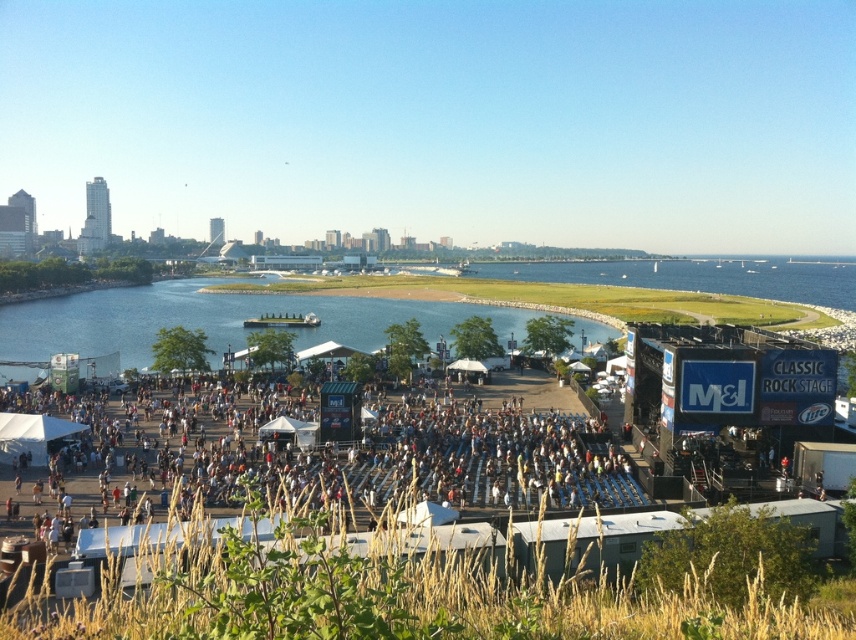
You are a photographer at the concert and want to capture a photo of the white fabric tent at center and the blue water at center. Which object is positioned to the right side of the other?

The white fabric tent at center is to the right of blue water at center.

You are a drone operator tasked with capturing aerial footage of the white fabric tent at center and blue water at center. Your drone has a maximum flight range of 70 meters. Can your drone safely capture footage of both locations without needing to recharge or return to base?

The white fabric tent at center and blue water at center are 71.15 meters apart from each other. Since the distance exceeds the drone s 70 meter range, the drone cannot safely capture footage of both locations without needing to recharge or return to base.

You are a photographer planning to capture the white fabric tent at center and the blue water at center in your shot. Based on the scene, which object is shorter in height?

The white fabric tent at center is shorter in height compared to the blue water at center.